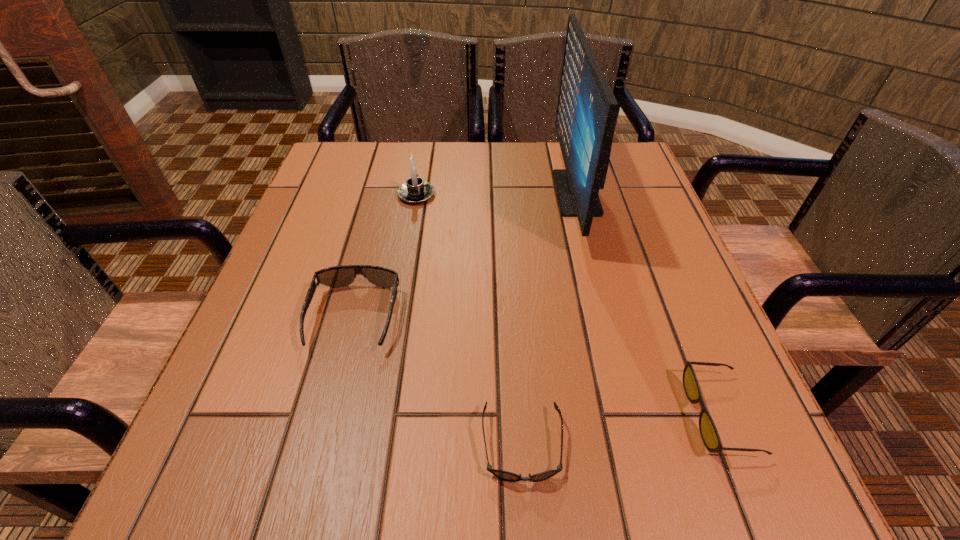
In order to click on empty space that is in between the fourth shortest object and the leftmost sunglasses in this screenshot , I will do `click(385, 256)`.

The width and height of the screenshot is (960, 540). I want to click on empty space that is in between the fourth object from left to right and the rightmost object, so click(x=648, y=304).

Find the location of a particular element. the second closest object to the second tallest object is located at coordinates (586, 114).

Find the location of a particular element. The image size is (960, 540). object that is the closest to the third object from left to right is located at coordinates (337, 276).

Locate which sunglasses ranks in proximity to the computer monitor. Please provide its 2D coordinates. Your answer should be formatted as a tuple, i.e. [(x, y)], where the tuple contains the x and y coordinates of a point satisfying the conditions above.

[(708, 431)]

Find the location of a particular element. sunglasses that is the second closest one to the third nearest object is located at coordinates pyautogui.click(x=708, y=431).

Where is `vacant space that satisfies the following two spatial constraints: 1. on the front-facing side of the second shortest sunglasses; 2. on the lenses of the third object from right to left`? This screenshot has width=960, height=540. vacant space that satisfies the following two spatial constraints: 1. on the front-facing side of the second shortest sunglasses; 2. on the lenses of the third object from right to left is located at coordinates (732, 445).

At what (x,y) coordinates should I click in order to perform the action: click on free spot that satisfies the following two spatial constraints: 1. on the screen side of the second object from right to left; 2. on the lenses of the third object from left to right. Please return your answer as a coordinate pair (x, y). This screenshot has height=540, width=960. Looking at the image, I should click on (641, 445).